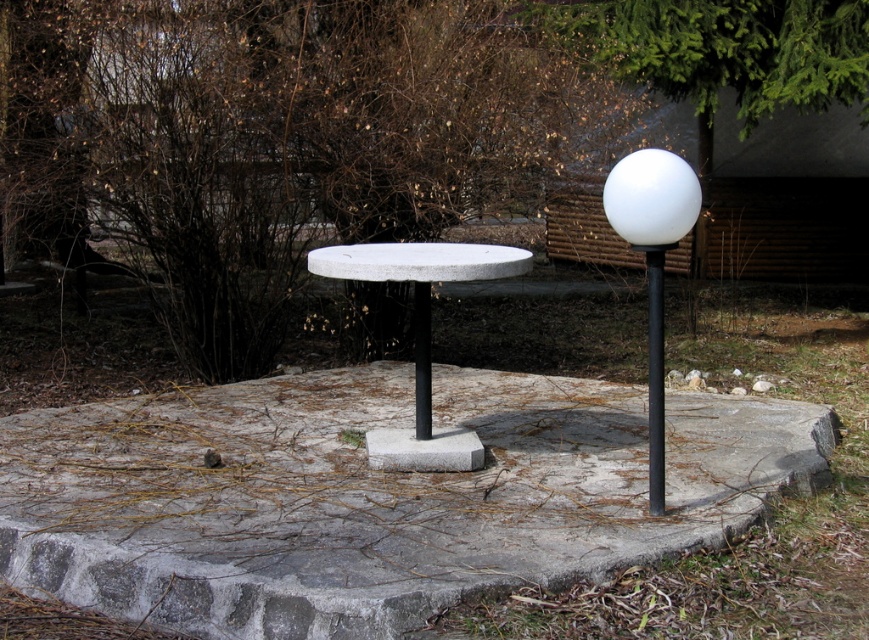
Looking at this image, you are standing on the gray concrete at center and want to reach the black metal pole at right. Which direction should you move in to get there?

You should move to the right from the gray concrete at center to reach the black metal pole at right since the gray concrete at center is located to the left of the black metal pole at right.